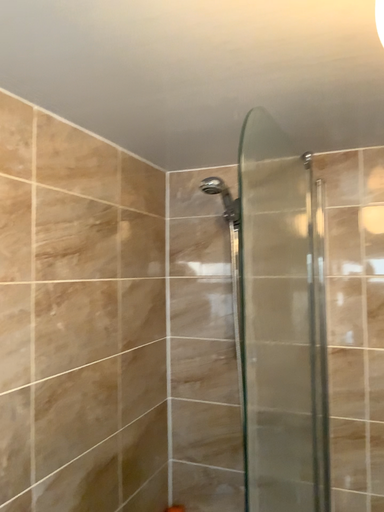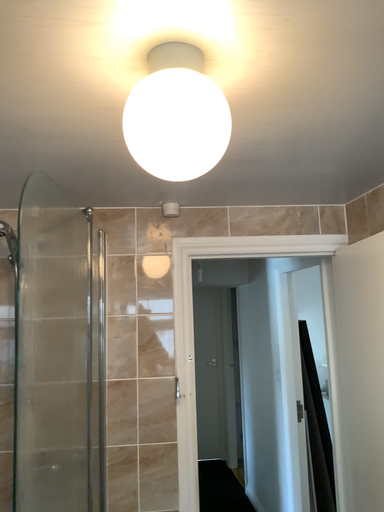
Question: How did the camera likely rotate when shooting the video?

Choices:
 (A) rotated right
 (B) rotated left

Answer: (A)